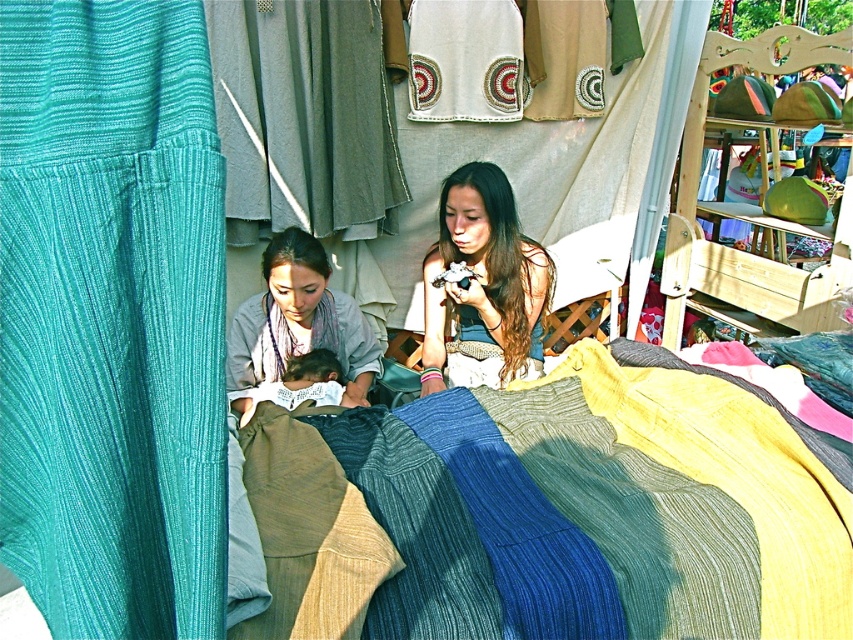
Who is more distant from viewer, [68,198] or [447,348]?

The point [447,348] is more distant.

Can you confirm if teal ribbed fabric at left is wider than matte blue dress at center?

In fact, teal ribbed fabric at left might be narrower than matte blue dress at center.

What do you see at coordinates (111, 317) in the screenshot?
I see `teal ribbed fabric at left` at bounding box center [111, 317].

Where is `teal ribbed fabric at left`? teal ribbed fabric at left is located at coordinates (111, 317).

Can you confirm if matte gray scarf at center is positioned below soft white fabric at center?

No, matte gray scarf at center is not below soft white fabric at center.

Who is more forward, (372, 337) or (248, 403)?

Point (248, 403) is in front.

At what (x,y) coordinates should I click in order to perform the action: click on matte gray scarf at center. Please return your answer as a coordinate pair (x, y). The image size is (853, 640). Looking at the image, I should click on (299, 321).

From the picture: Does teal ribbed fabric at left appear under soft white fabric at center?

No, teal ribbed fabric at left is not below soft white fabric at center.

Is teal ribbed fabric at left smaller than soft white fabric at center?

Incorrect, teal ribbed fabric at left is not smaller in size than soft white fabric at center.

The width and height of the screenshot is (853, 640). In order to click on teal ribbed fabric at left in this screenshot , I will do `click(111, 317)`.